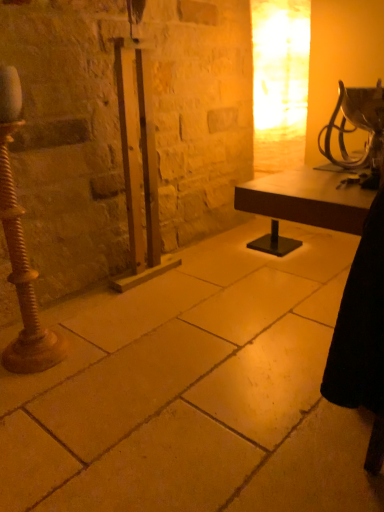
Identify the location of vacant space to the right of rusty metal pole at left. The width and height of the screenshot is (384, 512). (88, 355).